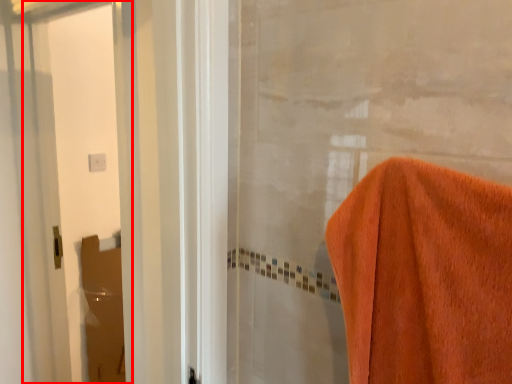
Question: Considering the relative positions of screen door (annotated by the red box) and screen door in the image provided, where is screen door (annotated by the red box) located with respect to the staircase?

Choices:
 (A) left
 (B) right

Answer: (B)